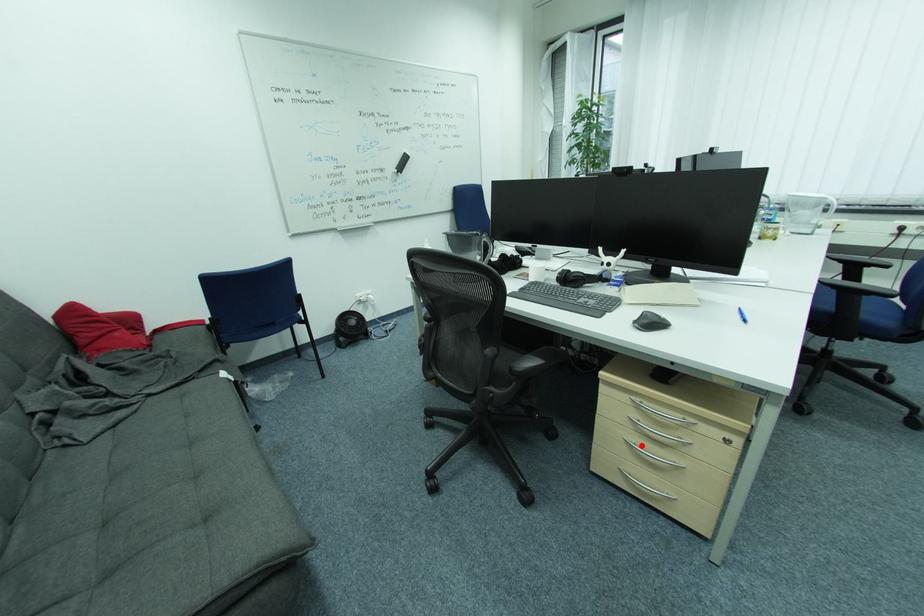
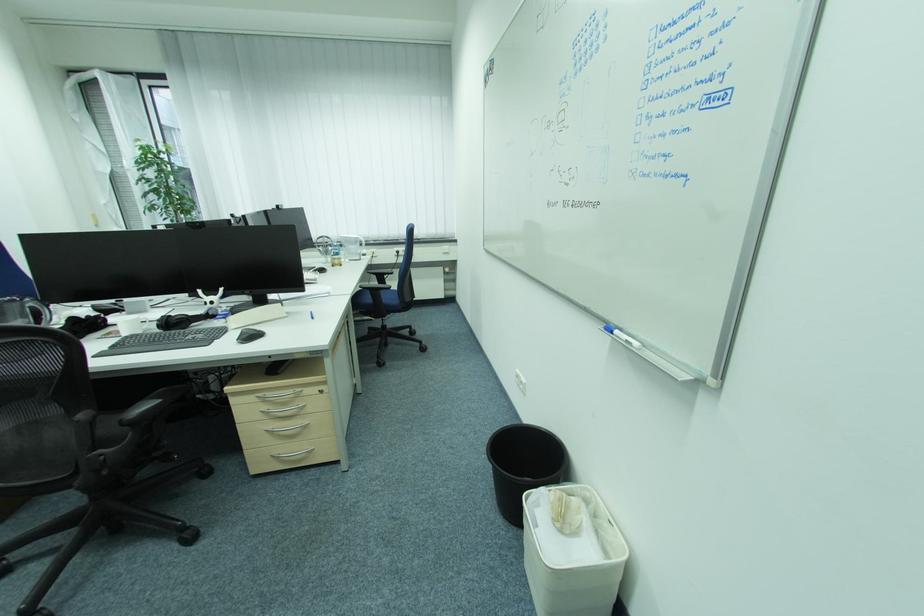
The point at the highlighted location is marked in the first image. Where is the corresponding point in the second image?

(281, 430)